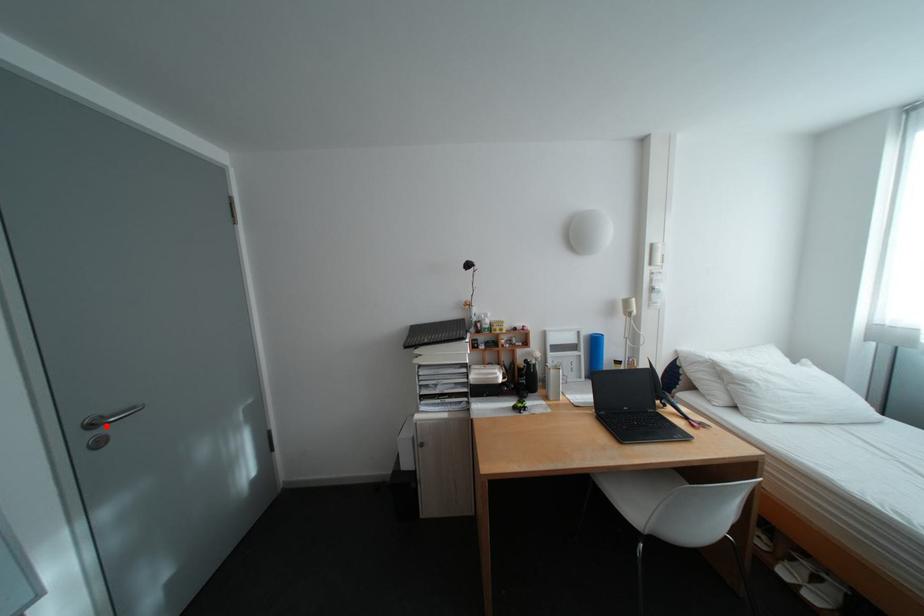
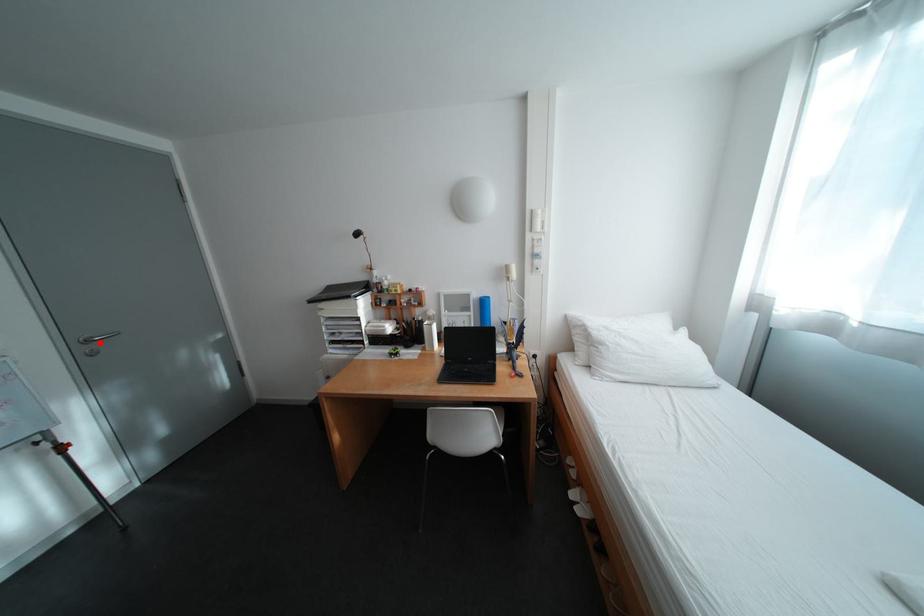
I am providing you with two images of the same scene from different viewpoints. A red point is marked on the first image and another point is marked on the second image. Is the marked point in image1 the same physical position as the marked point in image2?

Yes